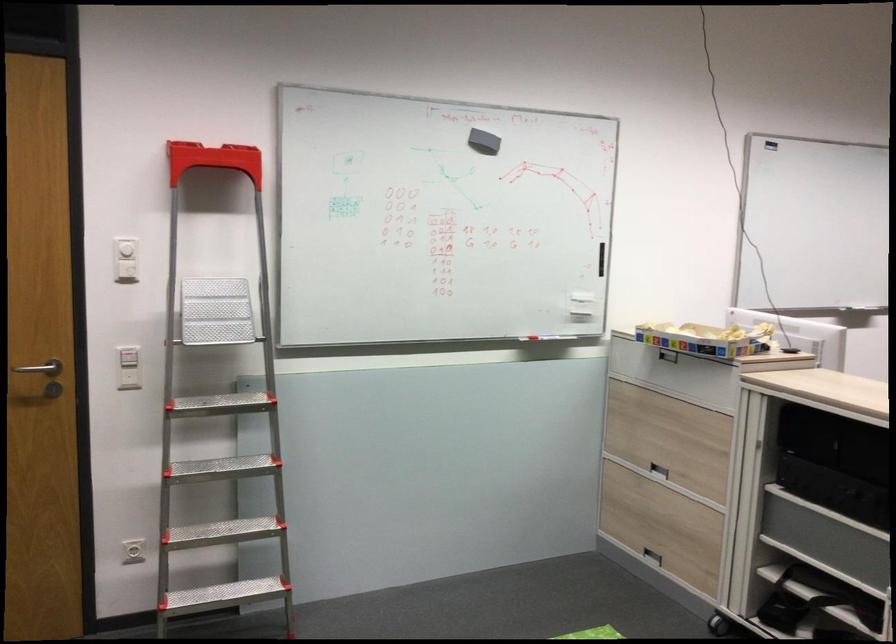
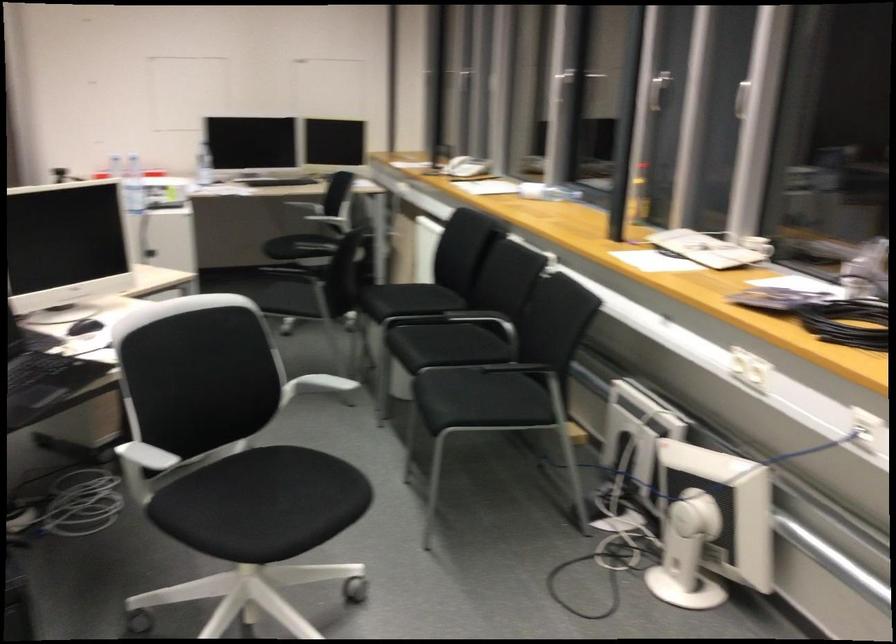
The first image is from the beginning of the video and the second image is from the end. How did the camera likely rotate when shooting the video?

The rotation direction of the camera is right-down.